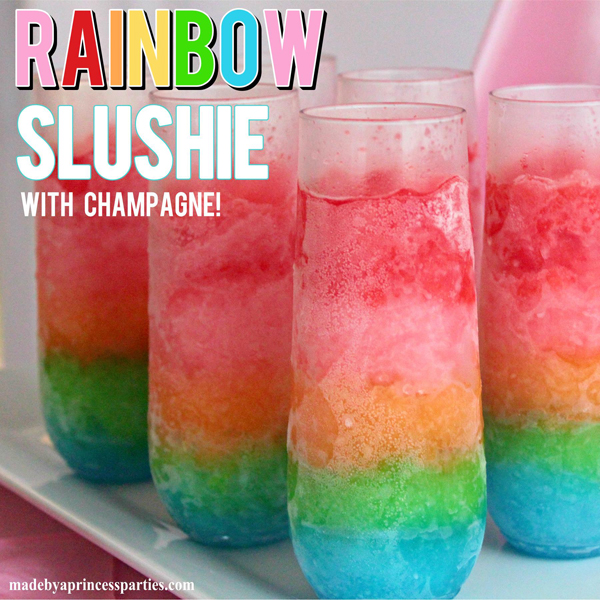
Identify the location of glasses of drinks. The height and width of the screenshot is (600, 600). (70, 293), (172, 291), (321, 283), (428, 86), (320, 96), (572, 220).